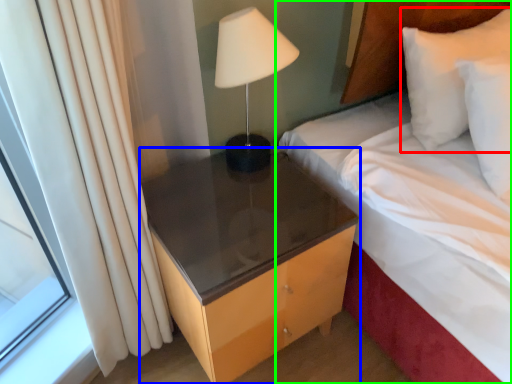
Question: Estimate the real-world distances between objects in this image. Which object is farther from pillow (highlighted by a red box), nightstand (highlighted by a blue box) or bed (highlighted by a green box)?

Choices:
 (A) nightstand
 (B) bed

Answer: (A)